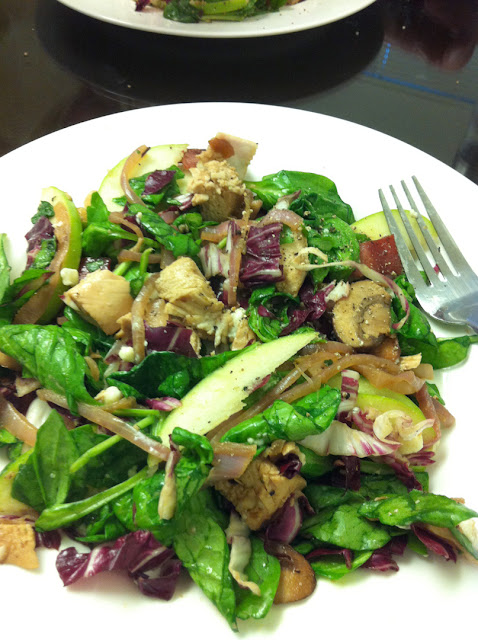
Image resolution: width=478 pixels, height=640 pixels. Identify the location of black table. (410, 89).